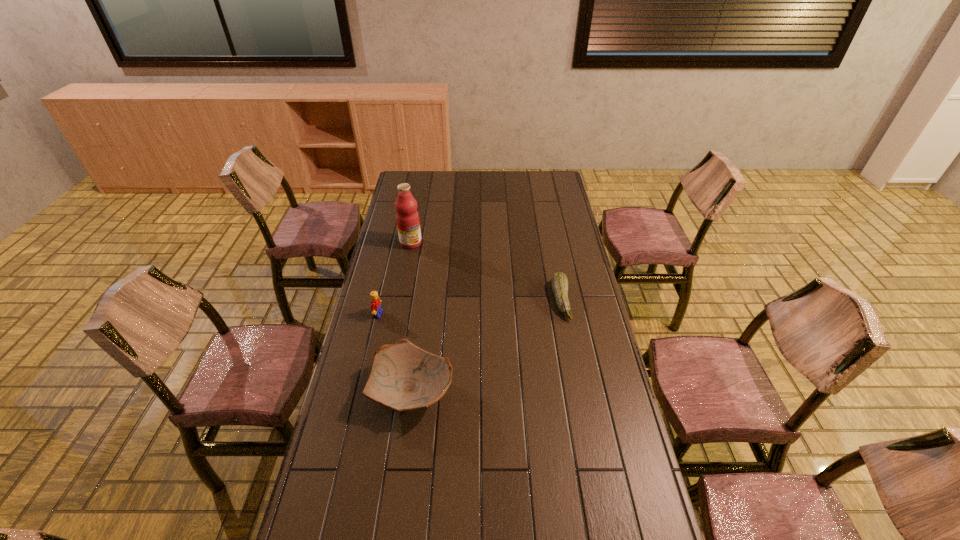
Locate an element on the screen. The image size is (960, 540). free location located on the label of the fruit juice is located at coordinates (427, 267).

I want to click on free space located 0.200m on the label of the fruit juice, so click(x=433, y=275).

Where is `free space located 0.070m on the label of the fruit juice`? free space located 0.070m on the label of the fruit juice is located at coordinates (421, 258).

Locate an element on the screen. pottery that is at the left edge is located at coordinates (404, 377).

Where is `Lego at the left edge`? This screenshot has width=960, height=540. Lego at the left edge is located at coordinates (375, 306).

Where is `fruit juice that is positioned at the left edge`? The height and width of the screenshot is (540, 960). fruit juice that is positioned at the left edge is located at coordinates coord(407,217).

Image resolution: width=960 pixels, height=540 pixels. In order to click on object present at the right edge in this screenshot , I will do pyautogui.click(x=559, y=281).

Identify the location of vacant point at the far edge. (433, 185).

Image resolution: width=960 pixels, height=540 pixels. I want to click on vacant area at the near edge, so click(565, 523).

Identify the location of free region at the left edge of the desktop. (366, 426).